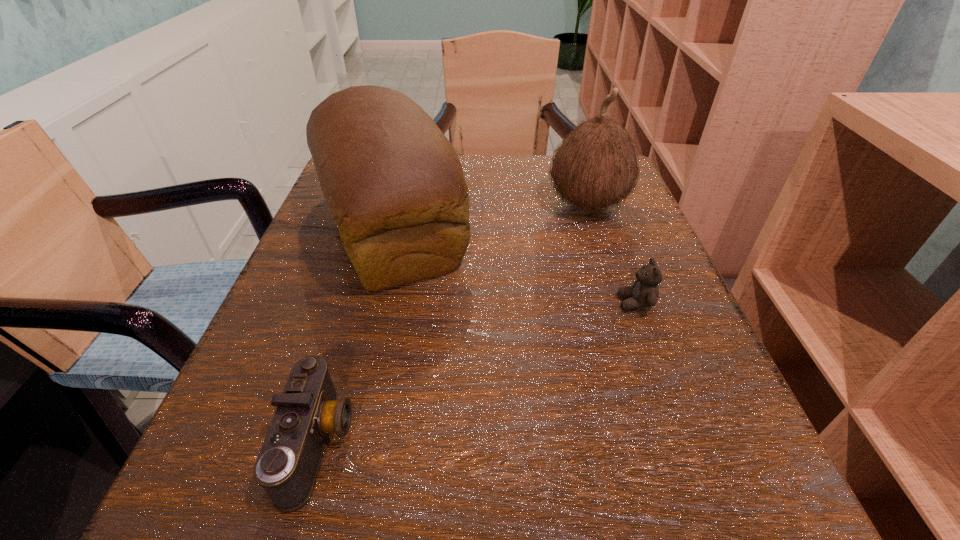
Image resolution: width=960 pixels, height=540 pixels. What are the coordinates of `vacant space in between the coconut and the teddy bear` in the screenshot? It's located at (612, 254).

You are a GUI agent. You are given a task and a screenshot of the screen. Output one action in this format:
    pyautogui.click(x=<x>, y=<y>)
    Task: Click on the free point between the camera and the coconut
    The image size is (960, 540).
    Given the screenshot: What is the action you would take?
    pyautogui.click(x=453, y=323)

Find the location of a particular element. The width and height of the screenshot is (960, 540). unoccupied position between the nearest object and the bread is located at coordinates (354, 336).

Image resolution: width=960 pixels, height=540 pixels. What are the coordinates of `empty space that is in between the coconut and the bread` in the screenshot? It's located at (489, 217).

Find the location of `unoccupied position between the teddy bear and the bread`. unoccupied position between the teddy bear and the bread is located at coordinates (513, 266).

At what (x,y) coordinates should I click in order to perform the action: click on vacant region between the nearest object and the teddy bear. Please return your answer as a coordinate pair (x, y). Looking at the image, I should click on (x=477, y=373).

Locate an element on the screen. This screenshot has height=540, width=960. object that is the second closest to the teddy bear is located at coordinates (394, 184).

Locate which object ranks in proximity to the nearest object. Please provide its 2D coordinates. Your answer should be formatted as a tuple, i.e. [(x, y)], where the tuple contains the x and y coordinates of a point satisfying the conditions above.

[(394, 184)]

At what (x,y) coordinates should I click in order to perform the action: click on blank area in the image that satisfies the following two spatial constraints: 1. on the surface of the coconut; 2. on the front side of the bread. Please return your answer as a coordinate pair (x, y). Looking at the image, I should click on (595, 229).

The width and height of the screenshot is (960, 540). Identify the location of free location that satisfies the following two spatial constraints: 1. on the surface of the coconut; 2. on the front side of the bread. (595, 229).